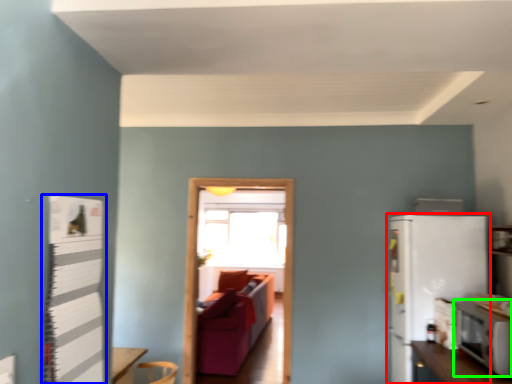
Question: Which object is positioned closest to refrigerator (highlighted by a red box)? Select from bulletin board (highlighted by a blue box) and appliance (highlighted by a green box).

Choices:
 (A) bulletin board
 (B) appliance

Answer: (B)